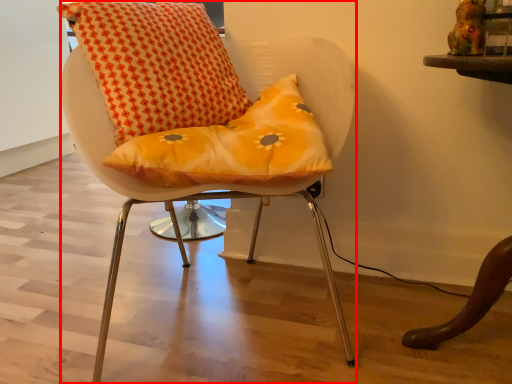
Question: From the image's perspective, what is the correct spatial relationship of chair (annotated by the red box) in relation to bean bag chair?

Choices:
 (A) above
 (B) below

Answer: (B)